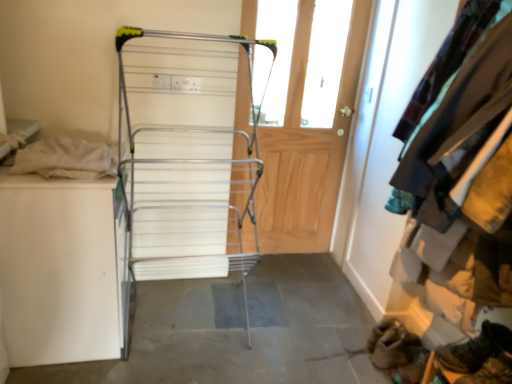
Question: Is wooden door at center surrounded by silver metallic drying rack at center?

Choices:
 (A) yes
 (B) no

Answer: (B)

Question: Considering the relative sizes of silver metallic drying rack at center and wooden door at center in the image provided, is silver metallic drying rack at center taller than wooden door at center?

Choices:
 (A) no
 (B) yes

Answer: (A)

Question: From the image's perspective, is silver metallic drying rack at center beneath wooden door at center?

Choices:
 (A) no
 (B) yes

Answer: (B)

Question: Is silver metallic drying rack at center behind wooden door at center?

Choices:
 (A) no
 (B) yes

Answer: (A)

Question: From a real-world perspective, is silver metallic drying rack at center physically below wooden door at center?

Choices:
 (A) no
 (B) yes

Answer: (B)

Question: Looking at their shapes, would you say gray concrete floor at center is wider or thinner than leather boot at lower right?

Choices:
 (A) wide
 (B) thin

Answer: (A)

Question: Is point (140, 312) closer or farther from the camera than point (456, 347)?

Choices:
 (A) closer
 (B) farther

Answer: (B)

Question: Is gray concrete floor at center inside the boundaries of leather boot at lower right, or outside?

Choices:
 (A) outside
 (B) inside

Answer: (A)

Question: Visually, is gray concrete floor at center positioned to the left or to the right of leather boot at lower right?

Choices:
 (A) left
 (B) right

Answer: (A)

Question: In terms of width, does leather boot at lower right look wider or thinner when compared to gray concrete floor at center?

Choices:
 (A) wide
 (B) thin

Answer: (B)

Question: From the image's perspective, is leather boot at lower right located above or below gray concrete floor at center?

Choices:
 (A) below
 (B) above

Answer: (B)

Question: Looking at the image, does leather boot at lower right seem bigger or smaller compared to gray concrete floor at center?

Choices:
 (A) small
 (B) big

Answer: (A)

Question: Would you say leather boot at lower right is inside or outside gray concrete floor at center?

Choices:
 (A) inside
 (B) outside

Answer: (B)

Question: Considering the positions of point (357, 326) and point (443, 203), is point (357, 326) closer or farther from the camera than point (443, 203)?

Choices:
 (A) farther
 (B) closer

Answer: (A)

Question: Is gray concrete floor at center wider or thinner than velvet teal jacket at upper right?

Choices:
 (A) thin
 (B) wide

Answer: (B)